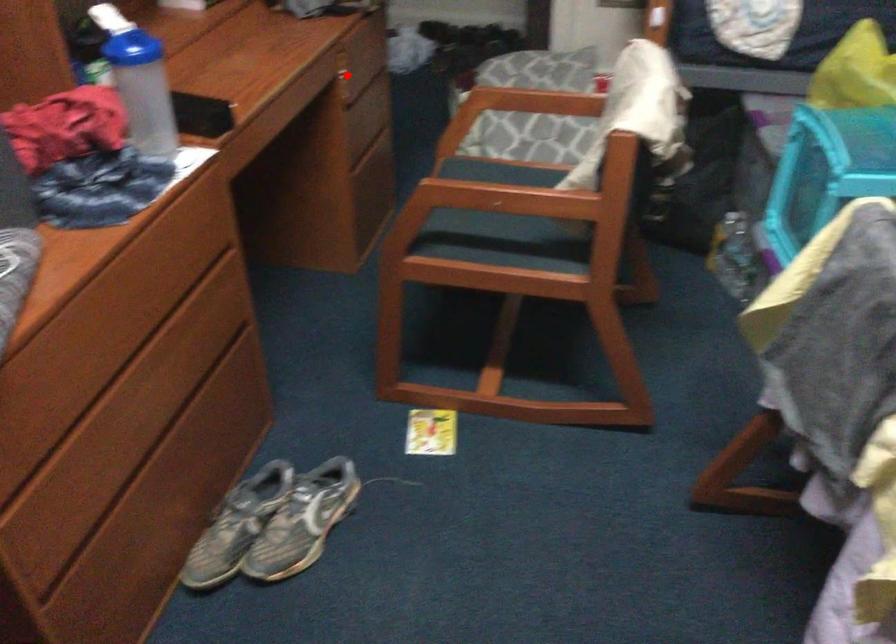
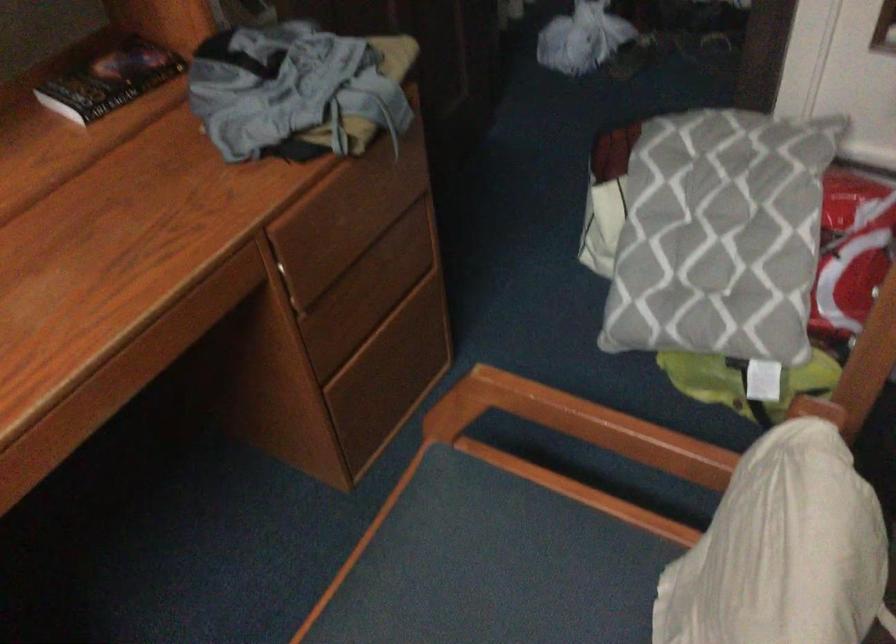
Where in the second image is the point corresponding to the highlighted location from the first image?

(299, 276)